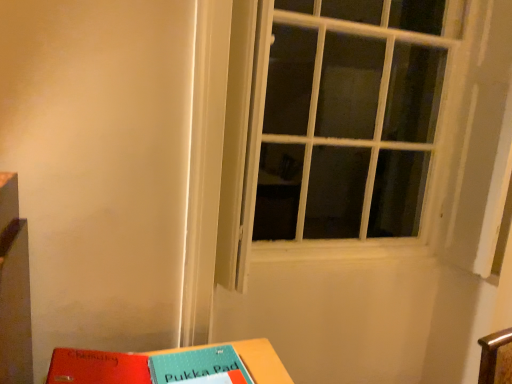
Question: Visually, is white textured window at center positioned to the left or to the right of red matte paper at lower left?

Choices:
 (A) right
 (B) left

Answer: (A)

Question: From a real-world perspective, relative to red matte paper at lower left, is white textured window at center vertically above or below?

Choices:
 (A) below
 (B) above

Answer: (B)

Question: Which of these objects is positioned closest to the white textured window at center?

Choices:
 (A) red matte paper at lower left
 (B) matte plastic table at lower center

Answer: (B)

Question: Which object is positioned closest to the red matte paper at lower left?

Choices:
 (A) matte plastic table at lower center
 (B) white textured window at center

Answer: (A)